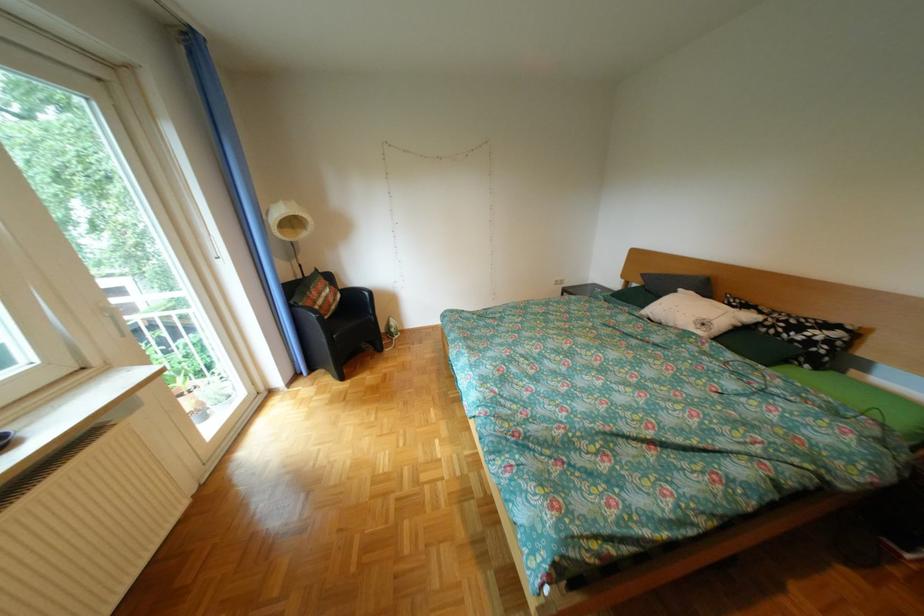
You are a GUI agent. You are given a task and a screenshot of the screen. Output one action in this format:
    pyautogui.click(x=<x>, y=<y>)
    Task: Click on the black chair armrest
    
    Given the screenshot: What is the action you would take?
    pyautogui.click(x=314, y=315)